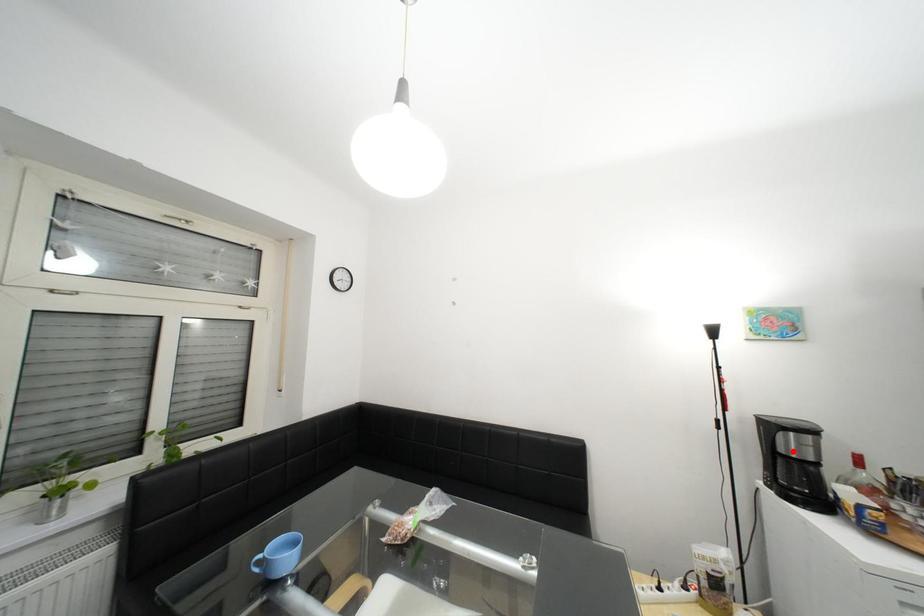
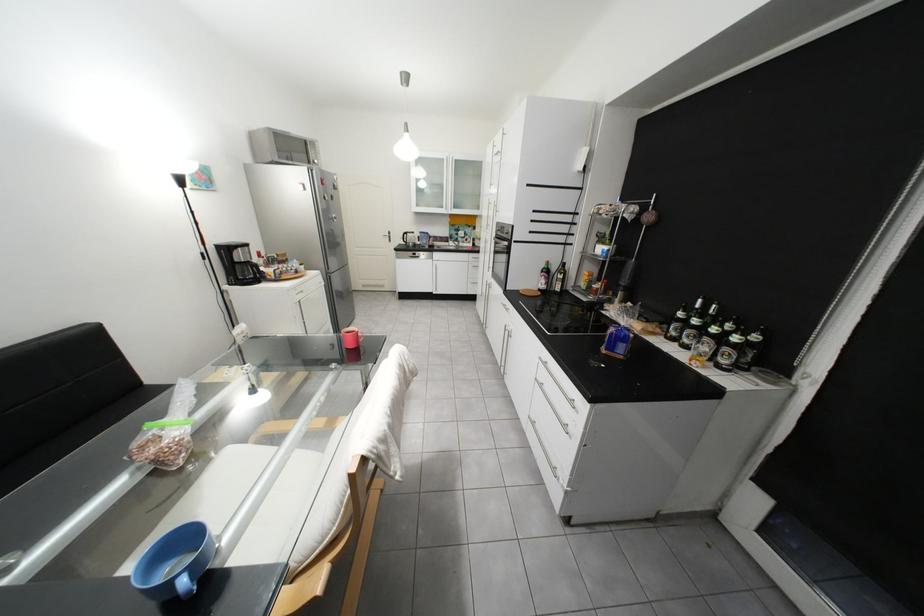
Where in the second image is the point corresponding to the highlighted location from the first image?

(249, 262)